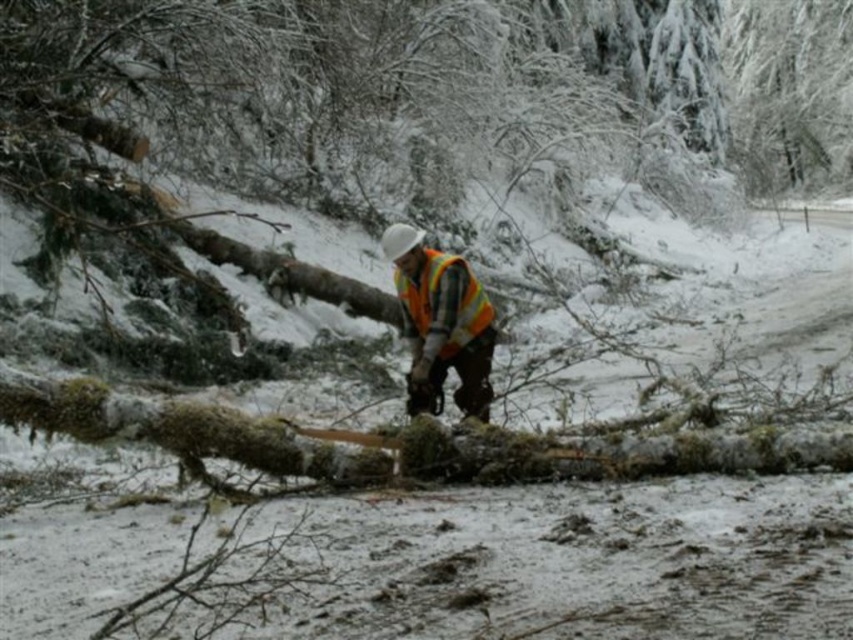
Question: Which point is farther from the camera taking this photo?

Choices:
 (A) (396, 276)
 (B) (457, 289)

Answer: (A)

Question: Is orange reflective vest at center positioned in front of reflective orange safety vest at center?

Choices:
 (A) no
 (B) yes

Answer: (B)

Question: From the image, what is the correct spatial relationship of orange reflective vest at center in relation to reflective orange safety vest at center?

Choices:
 (A) left
 (B) right

Answer: (B)

Question: Does orange reflective vest at center appear under reflective orange safety vest at center?

Choices:
 (A) yes
 (B) no

Answer: (A)

Question: Which object appears farthest from the camera in this image?

Choices:
 (A) orange reflective vest at center
 (B) reflective orange safety vest at center

Answer: (B)